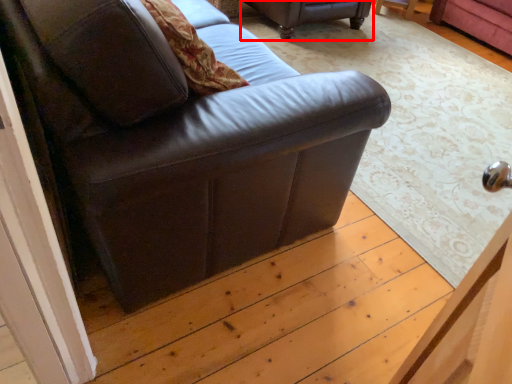
Question: From the image's perspective, where is studio couch (annotated by the red box) located relative to studio couch?

Choices:
 (A) above
 (B) below

Answer: (A)